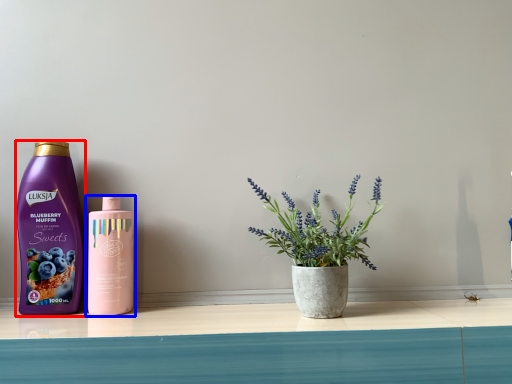
Question: Among these objects, which one is nearest to the camera, bottle (highlighted by a red box) or bottle (highlighted by a blue box)?

Choices:
 (A) bottle
 (B) bottle

Answer: (B)